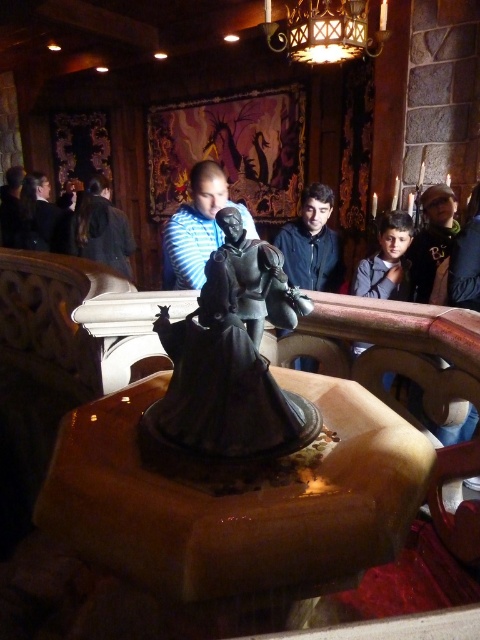
You are a guest at this themed attraction and want to take a photo of the metallic gold chandelier at upper center and the striped shirt at center. Which object should you focus on first if you want to ensure both are in the frame without moving the camera?

You should focus on the metallic gold chandelier at upper center first because it is smaller in size compared to the striped shirt at center, so it might require more precise framing to include both in the shot.

You are standing in the themed attraction and want to take a photo of the shiny bronze statue at center without the dark blue shirt at left appearing in the frame. Is this possible given their positions?

The shiny bronze statue at center is below the dark blue shirt at left, so if you position yourself to aim the camera downward towards the statue, you can avoid including the dark blue shirt at left in the frame.

You are standing in the themed attraction and want to take a photo of the striped shirt at center without the metallic gold chandelier at upper center blocking the view. Is this possible?

The metallic gold chandelier at upper center is further to the viewer than the striped shirt at center, so it is blocking the view. To take a photo of the striped shirt at center without the chandelier blocking, you would need to move your position so that the chandelier is no longer in front of the shirt.